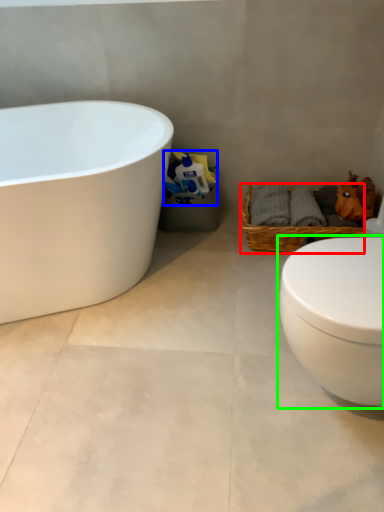
Question: Which object is positioned farthest from picnic basket (highlighted by a red box)? Select from toilet paper (highlighted by a blue box) and toilet (highlighted by a green box).

Choices:
 (A) toilet paper
 (B) toilet

Answer: (B)